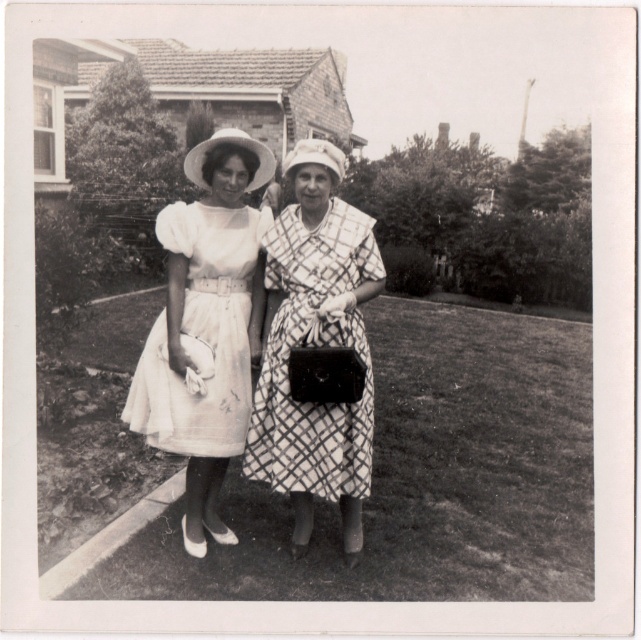
You are a photographer setting up a shoot in the residential area shown. You need to position a backdrop behind the two dresses mentioned. Since the backdrop is 1.5 meters tall, will it adequately cover both the patterned fabric dress at center and the white tulle dress at center?

The patterned fabric dress at center is taller than the white tulle dress at center. Since the backdrop is 1.5 meters tall, it will cover both dresses as long as the tallest dress, the patterned fabric dress at center, is no taller than 1.5 meters. However, without knowing the exact height of the dresses, we cannot confirm if the backdrop will be sufficient.

You are a photographer trying to capture a clear photo of both the patterned fabric dress at center and the white tulle dress at center. Since the two dresses are positioned close to each other, will adjusting the camera focus allow you to have both in sharp focus?

The patterned fabric dress at center is in front of the white tulle dress at center, so adjusting the focus to the middle distance between them might allow both to be in focus. Alternatively, using a smaller aperture could increase depth of field to capture both dresses clearly.